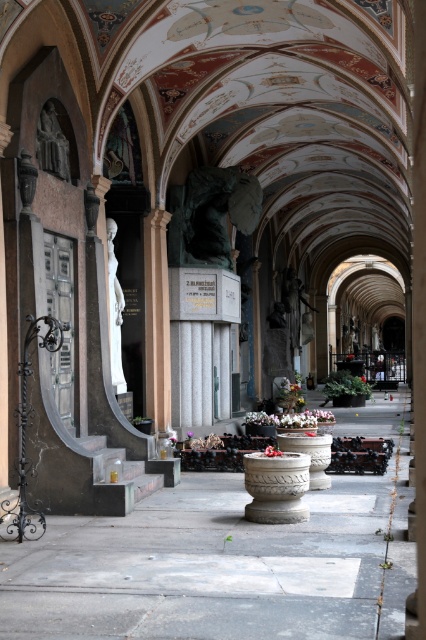
You are an architect examining the corridor and need to determine the placement of a new light fixture. The fixture requires a clear vertical space of 2 meters. Given the positions of the white marble statue at left and the matte stone statue at left, is there enough vertical space between them to install the fixture?

The white marble statue at left is below the matte stone statue at left, so there is vertical space between them. However, the exact height isn t specified, so we cannot confirm if it s exactly 2 meters. Further measurements are needed.

You are a tour guide leading visitors through the cemetery corridor. You need to ensure that a 5 meter long banner can be hung between the green bronze statue at center and the white marble statue at left. Is there enough space between them to hang the banner?

The distance between the green bronze statue at center and the white marble statue at left is 4.65 meters. Since the banner is 5 meters long, it is slightly too long to fit between them without overlapping either statue.